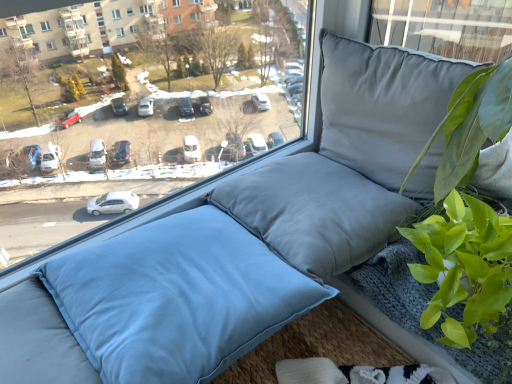
Question: From a real-world perspective, is matte gray cushion at center physically below satin gray pillow at center, which ranks as the 2th pillow in bottom-to-top order?

Choices:
 (A) no
 (B) yes

Answer: (A)

Question: Is matte gray cushion at center looking in the opposite direction of satin gray pillow at center, arranged as the second pillow when viewed from the top?

Choices:
 (A) no
 (B) yes

Answer: (A)

Question: Can you confirm if matte gray cushion at center is positioned to the left of satin gray pillow at center, which ranks as the 2th pillow in bottom-to-top order?

Choices:
 (A) no
 (B) yes

Answer: (B)

Question: Does matte gray cushion at center have a greater width compared to satin gray pillow at center, which ranks as the 2th pillow in bottom-to-top order?

Choices:
 (A) no
 (B) yes

Answer: (A)

Question: Is matte gray cushion at center oriented towards satin gray pillow at center, which ranks as the 2th pillow in bottom-to-top order?

Choices:
 (A) yes
 (B) no

Answer: (A)

Question: Is green leafy plant at right wider or thinner than light blue fabric pillow at center, the 1th pillow ordered from the bottom?

Choices:
 (A) wide
 (B) thin

Answer: (B)

Question: From the image's perspective, is green leafy plant at right located above or below light blue fabric pillow at center, which is the 3th pillow from top to bottom?

Choices:
 (A) below
 (B) above

Answer: (B)

Question: In the image, is green leafy plant at right positioned in front of or behind light blue fabric pillow at center, which is the 3th pillow from top to bottom?

Choices:
 (A) behind
 (B) front

Answer: (A)

Question: Is green leafy plant at right taller or shorter than light blue fabric pillow at center, which is the 3th pillow from top to bottom?

Choices:
 (A) short
 (B) tall

Answer: (B)

Question: From a real-world perspective, is green leafy plant at right positioned above or below gray fabric pillow at upper right, placed as the third pillow when sorted from bottom to top?

Choices:
 (A) below
 (B) above

Answer: (A)

Question: Does point click(x=420, y=243) appear closer or farther from the camera than point click(x=404, y=67)?

Choices:
 (A) farther
 (B) closer

Answer: (B)

Question: From the image's perspective, is green leafy plant at right above or below gray fabric pillow at upper right, arranged as the first pillow when viewed from the top?

Choices:
 (A) above
 (B) below

Answer: (B)

Question: In the image, is green leafy plant at right positioned in front of or behind gray fabric pillow at upper right, arranged as the first pillow when viewed from the top?

Choices:
 (A) behind
 (B) front

Answer: (B)

Question: Is light blue fabric pillow at center, the 1th pillow ordered from the bottom, bigger or smaller than gray fabric pillow at upper right, placed as the third pillow when sorted from bottom to top?

Choices:
 (A) small
 (B) big

Answer: (B)

Question: Is light blue fabric pillow at center, the 1th pillow ordered from the bottom, taller or shorter than gray fabric pillow at upper right, arranged as the first pillow when viewed from the top?

Choices:
 (A) tall
 (B) short

Answer: (B)